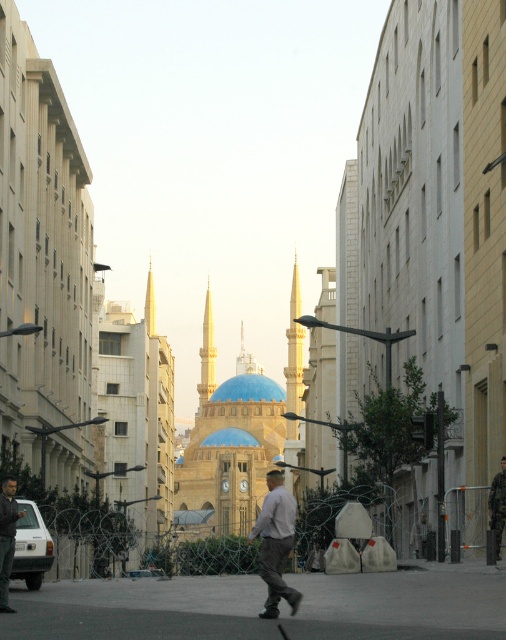
You are a tourist standing at the center of the street in front of the blue domed building. You see a light gray fabric shirt at center. Can you tell me what is located at the point with coordinates (275, 544)?

The point at coordinates (275, 544) has the light gray fabric shirt at center located there.

You are a tourist standing on the street looking at the light yellow stone spire at center and the khaki cotton pants at center. Which object is higher from the ground?

The light yellow stone spire at center is above khaki cotton pants at center, so the light yellow stone spire at center is higher from the ground.

You are standing on the paved road in the foreground of the scene. You want to take a photo of the light yellow stone spire at center. Which direction should you face to ensure the spire is in the center of your photo?

The light yellow stone spire at center is located at point (206, 353), so you should face towards the center of the scene to capture it in the photo.